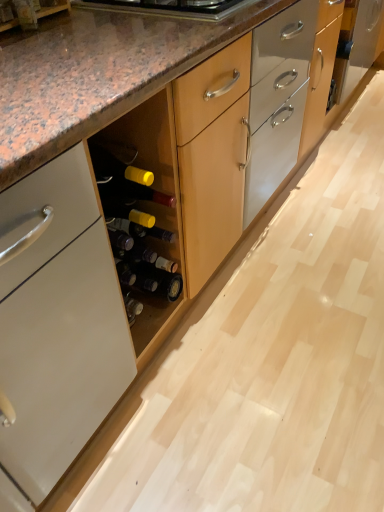
Looking at this image, what is the approximate width of matte brown wood at lower left?

It is 2.45 inches.

The height and width of the screenshot is (512, 384). What do you see at coordinates (137, 250) in the screenshot?
I see `matte glass beer bottle at center, the second beer bottle when ordered from bottom to top` at bounding box center [137, 250].

Locate an element on the screen. This screenshot has height=512, width=384. matte glass beer bottle at center, the second beer bottle when ordered from bottom to top is located at coordinates (137, 250).

The height and width of the screenshot is (512, 384). What are the coordinates of `matte black bottle at center, the 2th beer bottle viewed from the top` in the screenshot? It's located at (150, 279).

What do you see at coordinates (150, 279) in the screenshot? I see `matte black bottle at center, the 2th beer bottle viewed from the top` at bounding box center [150, 279].

Find the location of a particular element. This screenshot has width=384, height=512. matte brown wood at lower left is located at coordinates point(28,12).

From the image's perspective, is matte yellow glass wine bottle at center positioned above or below matte glass beer bottle at center, the second beer bottle when ordered from bottom to top?

Clearly, from the image's perspective, matte yellow glass wine bottle at center is above matte glass beer bottle at center, the second beer bottle when ordered from bottom to top.

Between point (138, 217) and point (151, 261), which one is positioned behind?

The point (151, 261) is farther.

From a real-world perspective, is matte yellow glass wine bottle at center positioned above or below matte glass beer bottle at center, the second beer bottle when ordered from bottom to top?

From a real-world perspective, matte yellow glass wine bottle at center is physically above matte glass beer bottle at center, the second beer bottle when ordered from bottom to top.

Between matte yellow glass wine bottle at center and matte glass beer bottle at center, the first beer bottle positioned from the top, which one appears on the right side from the viewer's perspective?

matte yellow glass wine bottle at center is more to the right.

Considering their positions, is matte black bottle at center, positioned as the first beer bottle in bottom-to-top order, located in front of or behind matte glass beer bottle at center, the first beer bottle positioned from the top?

matte black bottle at center, positioned as the first beer bottle in bottom-to-top order, is positioned farther from the viewer than matte glass beer bottle at center, the first beer bottle positioned from the top.

Can you confirm if matte black bottle at center, positioned as the first beer bottle in bottom-to-top order, is smaller than matte glass beer bottle at center, the first beer bottle positioned from the top?

Correct, matte black bottle at center, positioned as the first beer bottle in bottom-to-top order, occupies less space than matte glass beer bottle at center, the first beer bottle positioned from the top.

Can you confirm if matte black bottle at center, the 2th beer bottle viewed from the top, is shorter than matte glass beer bottle at center, the second beer bottle when ordered from bottom to top?

Yes, matte black bottle at center, the 2th beer bottle viewed from the top, is shorter than matte glass beer bottle at center, the second beer bottle when ordered from bottom to top.

Is matte black bottle at center, positioned as the first beer bottle in bottom-to-top order, directly adjacent to matte glass beer bottle at center, the second beer bottle when ordered from bottom to top?

Yes, matte black bottle at center, positioned as the first beer bottle in bottom-to-top order, is beside matte glass beer bottle at center, the second beer bottle when ordered from bottom to top.

Is wooden drawer at center wider or thinner than matte brown wood at lower left?

Clearly, wooden drawer at center has more width compared to matte brown wood at lower left.

Can you confirm if wooden drawer at center is shorter than matte brown wood at lower left?

In fact, wooden drawer at center may be taller than matte brown wood at lower left.

Is point (324, 19) farther from camera compared to point (23, 25)?

Yes, point (324, 19) is behind point (23, 25).

From a real-world perspective, is wooden drawer at center positioned above or below matte brown wood at lower left?

wooden drawer at center is situated lower than matte brown wood at lower left in the real world.

Is matte black bottle at center, positioned as the first beer bottle in bottom-to-top order, facing away from metallic stainless steel cooktop at upper center?

No, matte black bottle at center, positioned as the first beer bottle in bottom-to-top order, is not facing the opposite direction of metallic stainless steel cooktop at upper center.

Is matte black bottle at center, positioned as the first beer bottle in bottom-to-top order, placed right next to metallic stainless steel cooktop at upper center?

matte black bottle at center, positioned as the first beer bottle in bottom-to-top order, is not next to metallic stainless steel cooktop at upper center, and they're not touching.

Between matte black bottle at center, the 2th beer bottle viewed from the top, and metallic stainless steel cooktop at upper center, which one has smaller size?

Smaller between the two is matte black bottle at center, the 2th beer bottle viewed from the top.

Considering the sizes of objects matte black bottle at center, the 2th beer bottle viewed from the top, and metallic stainless steel cooktop at upper center in the image provided, who is shorter, matte black bottle at center, the 2th beer bottle viewed from the top, or metallic stainless steel cooktop at upper center?

With less height is metallic stainless steel cooktop at upper center.

Considering the relative sizes of matte glass beer bottle at center, the second beer bottle when ordered from bottom to top, and metallic stainless steel cooktop at upper center in the image provided, is matte glass beer bottle at center, the second beer bottle when ordered from bottom to top, thinner than metallic stainless steel cooktop at upper center?

Yes.

Is matte glass beer bottle at center, the second beer bottle when ordered from bottom to top, outside of metallic stainless steel cooktop at upper center?

Indeed, matte glass beer bottle at center, the second beer bottle when ordered from bottom to top, is completely outside metallic stainless steel cooktop at upper center.

Based on the photo, who is smaller, matte glass beer bottle at center, the second beer bottle when ordered from bottom to top, or metallic stainless steel cooktop at upper center?

matte glass beer bottle at center, the second beer bottle when ordered from bottom to top.

From the image's perspective, between matte glass beer bottle at center, the second beer bottle when ordered from bottom to top, and metallic stainless steel cooktop at upper center, which one is located above?

metallic stainless steel cooktop at upper center is shown above in the image.

Is matte yellow glass wine bottle at center oriented towards wooden drawer at center?

No, matte yellow glass wine bottle at center is not aimed at wooden drawer at center.

Would you consider matte yellow glass wine bottle at center to be distant from wooden drawer at center?

That's right, there is a large distance between matte yellow glass wine bottle at center and wooden drawer at center.

At what (x,y) coordinates should I click in order to perform the action: click on wine bottle located underneath the wooden drawer at center (from a real-world perspective). Please return your answer as a coordinate pair (x, y). Image resolution: width=384 pixels, height=512 pixels. Looking at the image, I should click on (137, 222).

Considering the sizes of objects matte yellow glass wine bottle at center and wooden drawer at center in the image provided, who is taller, matte yellow glass wine bottle at center or wooden drawer at center?

wooden drawer at center.

Measure the distance between matte yellow glass wine bottle at center and matte brown wood at lower left.

They are 21.11 inches apart.

Which of these two, matte yellow glass wine bottle at center or matte brown wood at lower left, is wider?

With larger width is matte yellow glass wine bottle at center.

Is point (132, 220) closer or farther from the camera than point (14, 11)?

Point (132, 220) is farther from the camera than point (14, 11).

You are a GUI agent. You are given a task and a screenshot of the screen. Output one action in this format:
    pyautogui.click(x=<x>, y=<y>)
    Task: Click on the shelf lying on the left of matte yellow glass wine bottle at center
    
    Given the screenshot: What is the action you would take?
    click(28, 12)

Where is `wine bottle that is on the right side of matte glass beer bottle at center, the second beer bottle when ordered from bottom to top`? The width and height of the screenshot is (384, 512). wine bottle that is on the right side of matte glass beer bottle at center, the second beer bottle when ordered from bottom to top is located at coordinates (137, 222).

Locate an element on the screen. Image resolution: width=384 pixels, height=512 pixels. beer bottle located below the matte glass beer bottle at center, the second beer bottle when ordered from bottom to top (from the image's perspective) is located at coordinates (150, 279).

From the image, which object appears to be nearer to matte brown wood at lower left, metallic stainless steel cooktop at upper center or matte glass beer bottle at center, the first beer bottle positioned from the top?

Based on the image, metallic stainless steel cooktop at upper center appears to be nearer to matte brown wood at lower left.

Which object lies nearer to the anchor point matte yellow glass wine bottle at center, matte glass beer bottle at center, the first beer bottle positioned from the top, or matte black bottle at center, the 2th beer bottle viewed from the top?

matte glass beer bottle at center, the first beer bottle positioned from the top.

Consider the image. Estimate the real-world distances between objects in this image. Which object is further from metallic stainless steel cooktop at upper center, matte brown wood at lower left or wooden drawer at center?

Among the two, wooden drawer at center is located further to metallic stainless steel cooktop at upper center.

From the image, which object appears to be farther from matte black bottle at center, positioned as the first beer bottle in bottom-to-top order, metallic stainless steel cooktop at upper center or matte brown wood at lower left?

matte brown wood at lower left is positioned further to the anchor matte black bottle at center, positioned as the first beer bottle in bottom-to-top order.

Which object lies nearer to the anchor point matte yellow glass wine bottle at center, matte brown wood at lower left or matte black bottle at center, the 2th beer bottle viewed from the top?

matte black bottle at center, the 2th beer bottle viewed from the top, is closer to matte yellow glass wine bottle at center.

Looking at the image, which one is located closer to matte glass beer bottle at center, the second beer bottle when ordered from bottom to top, metallic stainless steel cooktop at upper center or wooden drawer at center?

metallic stainless steel cooktop at upper center lies closer to matte glass beer bottle at center, the second beer bottle when ordered from bottom to top, than the other object.

Based on their spatial positions, is matte glass beer bottle at center, the second beer bottle when ordered from bottom to top, or matte yellow glass wine bottle at center further from matte brown wood at lower left?

matte glass beer bottle at center, the second beer bottle when ordered from bottom to top, is positioned further to the anchor matte brown wood at lower left.

Estimate the real-world distances between objects in this image. Which object is closer to matte glass beer bottle at center, the first beer bottle positioned from the top, matte black bottle at center, the 2th beer bottle viewed from the top, or matte yellow glass wine bottle at center?

Based on the image, matte black bottle at center, the 2th beer bottle viewed from the top, appears to be nearer to matte glass beer bottle at center, the first beer bottle positioned from the top.

You are a GUI agent. You are given a task and a screenshot of the screen. Output one action in this format:
    pyautogui.click(x=<x>, y=<y>)
    Task: Click on the shelf between metallic stainless steel cooktop at upper center and matte yellow glass wine bottle at center vertically
    The height and width of the screenshot is (512, 384).
    Given the screenshot: What is the action you would take?
    pyautogui.click(x=28, y=12)

At what (x,y) coordinates should I click in order to perform the action: click on shelf that lies between metallic stainless steel cooktop at upper center and matte glass beer bottle at center, the first beer bottle positioned from the top, from top to bottom. Please return your answer as a coordinate pair (x, y). The height and width of the screenshot is (512, 384). Looking at the image, I should click on (28, 12).

The height and width of the screenshot is (512, 384). I want to click on wine bottle between matte brown wood at lower left and matte black bottle at center, the 2th beer bottle viewed from the top, in the vertical direction, so click(137, 222).

At what (x,y) coordinates should I click in order to perform the action: click on beer bottle that lies between wooden drawer at center and matte black bottle at center, positioned as the first beer bottle in bottom-to-top order, from top to bottom. Please return your answer as a coordinate pair (x, y). This screenshot has height=512, width=384. Looking at the image, I should click on (137, 250).